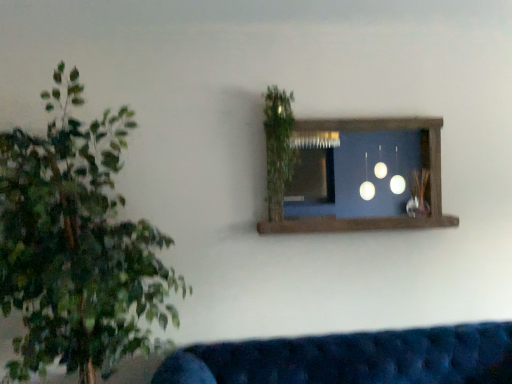
In order to face velvet blue couch at lower center, should I rotate leftwards or rightwards?

You should look right and rotate roughly 15.986 degrees.

What do you see at coordinates (352, 358) in the screenshot?
I see `velvet blue couch at lower center` at bounding box center [352, 358].

What do you see at coordinates (77, 246) in the screenshot? I see `green leafy plant at left` at bounding box center [77, 246].

Measure the distance between brown wooden window frame at upper center and camera.

brown wooden window frame at upper center is 2.24 meters from camera.

What do you see at coordinates (278, 147) in the screenshot? This screenshot has width=512, height=384. I see `green leafy plant at upper center` at bounding box center [278, 147].

Image resolution: width=512 pixels, height=384 pixels. I want to click on velvet blue couch at lower center, so click(352, 358).

Measure the distance between velvet blue couch at lower center and green leafy plant at upper center.

A distance of 37.36 inches exists between velvet blue couch at lower center and green leafy plant at upper center.

Which of these two, velvet blue couch at lower center or green leafy plant at upper center, is thinner?

Thinner between the two is green leafy plant at upper center.

From the image's perspective, is velvet blue couch at lower center beneath green leafy plant at upper center?

Yes, from the image's perspective, velvet blue couch at lower center is below green leafy plant at upper center.

Is brown wooden window frame at upper center oriented towards green leafy plant at left?

No, brown wooden window frame at upper center is not aimed at green leafy plant at left.

From the image's perspective, is brown wooden window frame at upper center on green leafy plant at left?

Yes, from the image's perspective, brown wooden window frame at upper center is on top of green leafy plant at left.

Does brown wooden window frame at upper center come behind green leafy plant at left?

Yes, brown wooden window frame at upper center is behind green leafy plant at left.

Could velvet blue couch at lower center be considered to be inside brown wooden window frame at upper center?

No, velvet blue couch at lower center is not surrounded by brown wooden window frame at upper center.

Locate an element on the screen. The width and height of the screenshot is (512, 384). studio couch below the brown wooden window frame at upper center (from the image's perspective) is located at coordinates (352, 358).

Can you tell me how much brown wooden window frame at upper center and velvet blue couch at lower center differ in facing direction?

They differ by 0.24 degrees in their facing directions.

Does brown wooden window frame at upper center turn towards velvet blue couch at lower center?

No, brown wooden window frame at upper center is not oriented towards velvet blue couch at lower center.

Does green leafy plant at left have a lesser height compared to brown wooden window frame at upper center?

No.

Who is bigger, green leafy plant at left or brown wooden window frame at upper center?

green leafy plant at left.

Are green leafy plant at left and brown wooden window frame at upper center located far from each other?

green leafy plant at left is far away from brown wooden window frame at upper center.

Looking at their sizes, would you say green leafy plant at left is wider or thinner than brown wooden window frame at upper center?

Clearly, green leafy plant at left has more width compared to brown wooden window frame at upper center.

At what (x,y) coordinates should I click in order to perform the action: click on window frame that appears on the left of velvet blue couch at lower center. Please return your answer as a coordinate pair (x, y). This screenshot has width=512, height=384. Looking at the image, I should click on (376, 217).

From a real-world perspective, is velvet blue couch at lower center under brown wooden window frame at upper center?

Yes.

Are velvet blue couch at lower center and brown wooden window frame at upper center making contact?

No, velvet blue couch at lower center is not touching brown wooden window frame at upper center.

Considering the positions of points (474, 364) and (370, 227), is point (474, 364) farther from camera compared to point (370, 227)?

No, it is not.

From the image's perspective, which object appears higher, green leafy plant at upper center or brown wooden window frame at upper center?

green leafy plant at upper center is shown above in the image.

Is green leafy plant at upper center positioned with its back to brown wooden window frame at upper center?

Yes, green leafy plant at upper center is facing away from brown wooden window frame at upper center.

Identify the location of window frame located below the green leafy plant at upper center (from the image's perspective). This screenshot has width=512, height=384. (376, 217).

Would you say green leafy plant at upper center is to the left or to the right of brown wooden window frame at upper center in the picture?

green leafy plant at upper center is to the left of brown wooden window frame at upper center.

Is velvet blue couch at lower center located within green leafy plant at left?

No.

Is green leafy plant at left not near velvet blue couch at lower center?

green leafy plant at left is near velvet blue couch at lower center, not far away.

In the scene shown: Which of these two, green leafy plant at left or velvet blue couch at lower center, is bigger?

green leafy plant at left.

Image resolution: width=512 pixels, height=384 pixels. Identify the location of plant that is above the velvet blue couch at lower center (from the image's perspective). (278, 147).

This screenshot has height=384, width=512. I want to click on window frame behind the green leafy plant at left, so click(x=376, y=217).

Considering their positions, is brown wooden window frame at upper center positioned closer to velvet blue couch at lower center than green leafy plant at left?

Based on the image, brown wooden window frame at upper center appears to be nearer to velvet blue couch at lower center.

Which object lies further to the anchor point brown wooden window frame at upper center, green leafy plant at left or velvet blue couch at lower center?

green leafy plant at left.

Considering their positions, is green leafy plant at left positioned closer to velvet blue couch at lower center than green leafy plant at upper center?

green leafy plant at left lies closer to velvet blue couch at lower center than the other object.

Which object lies nearer to the anchor point green leafy plant at upper center, brown wooden window frame at upper center or green leafy plant at left?

brown wooden window frame at upper center.

Considering their positions, is velvet blue couch at lower center positioned closer to green leafy plant at left than brown wooden window frame at upper center?

velvet blue couch at lower center is positioned closer to the anchor green leafy plant at left.

When comparing their distances from green leafy plant at upper center, does velvet blue couch at lower center or brown wooden window frame at upper center seem further?

velvet blue couch at lower center lies further to green leafy plant at upper center than the other object.

When comparing their distances from velvet blue couch at lower center, does green leafy plant at upper center or brown wooden window frame at upper center seem further?

Based on the image, green leafy plant at upper center appears to be further to velvet blue couch at lower center.

Based on their spatial positions, is brown wooden window frame at upper center or green leafy plant at upper center closer to velvet blue couch at lower center?

brown wooden window frame at upper center lies closer to velvet blue couch at lower center than the other object.

This screenshot has height=384, width=512. I want to click on plant between green leafy plant at left and velvet blue couch at lower center in the horizontal direction, so click(278, 147).

Identify the location of plant located between green leafy plant at left and brown wooden window frame at upper center in the left-right direction. (278, 147).

Identify the location of window frame between green leafy plant at upper center and velvet blue couch at lower center from top to bottom. This screenshot has height=384, width=512. (376, 217).

Where is `window frame situated between green leafy plant at left and velvet blue couch at lower center from left to right`? window frame situated between green leafy plant at left and velvet blue couch at lower center from left to right is located at coordinates [376, 217].